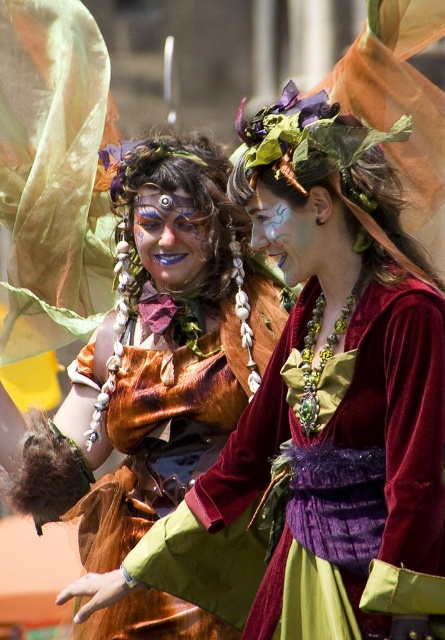
Between point (320, 472) and point (183, 406), which one is positioned in front?

Point (320, 472)

Which is below, velvet dress at center or velvet/golden-brown dress at center?

velvet/golden-brown dress at center is lower down.

Where is `velvet dress at center`? velvet dress at center is located at coordinates (322, 419).

Is velvet/golden-brown dress at center smaller than matte green face at center?

Actually, velvet/golden-brown dress at center might be larger than matte green face at center.

Can you confirm if velvet/golden-brown dress at center is positioned below matte green face at center?

Indeed, velvet/golden-brown dress at center is positioned under matte green face at center.

Is point (125, 317) closer to camera compared to point (146, 248)?

That is False.

You are a GUI agent. You are given a task and a screenshot of the screen. Output one action in this format:
    pyautogui.click(x=<x>, y=<y>)
    Task: Click on the velvet/golden-brown dress at center
    The height and width of the screenshot is (640, 445).
    Given the screenshot: What is the action you would take?
    [154, 355]

Can you confirm if velvet dress at center is wider than matte green face at center?

Correct, the width of velvet dress at center exceeds that of matte green face at center.

How much distance is there between velvet dress at center and matte green face at center?

velvet dress at center is 55.13 feet away from matte green face at center.

The image size is (445, 640). I want to click on velvet dress at center, so click(x=322, y=419).